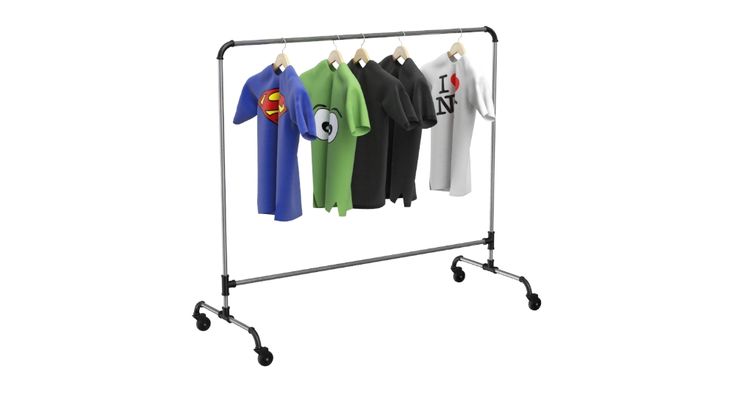
Where is `wire hook on hanger`? wire hook on hanger is located at coordinates (284, 40), (334, 36), (362, 36), (403, 32), (462, 30).